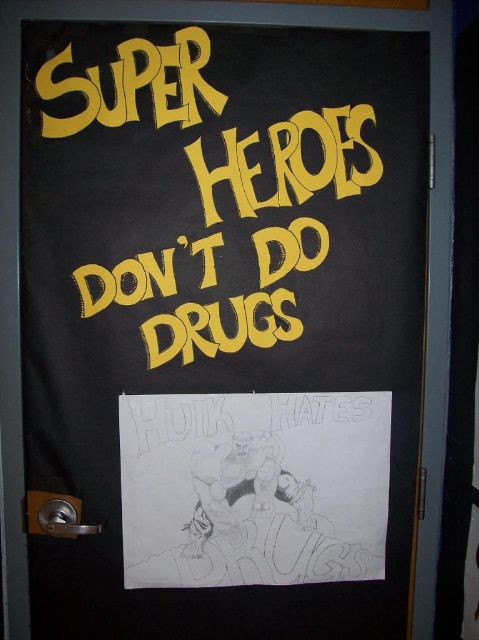
Question: Which point is closer to the camera?

Choices:
 (A) (295, 536)
 (B) (69, 109)

Answer: (B)

Question: Which object appears farthest from the camera in this image?

Choices:
 (A) yellow chalk text at upper center
 (B) graphite sketch at center

Answer: (B)

Question: Does graphite sketch at center appear over yellow chalk text at upper center?

Choices:
 (A) no
 (B) yes

Answer: (A)

Question: Does graphite sketch at center appear on the right side of yellow chalk text at upper center?

Choices:
 (A) no
 (B) yes

Answer: (B)

Question: Can you confirm if graphite sketch at center is smaller than yellow chalk text at upper center?

Choices:
 (A) yes
 (B) no

Answer: (A)

Question: Among these points, which one is farthest from the camera?

Choices:
 (A) (337, 568)
 (B) (204, 38)

Answer: (A)